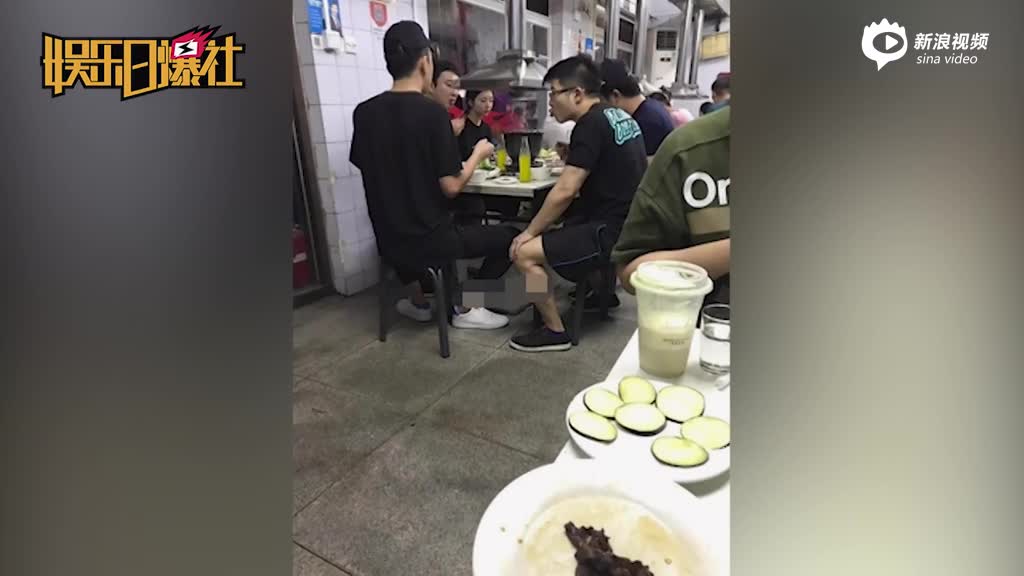
Identify the location of wall. This screenshot has width=1024, height=576. (340, 84).